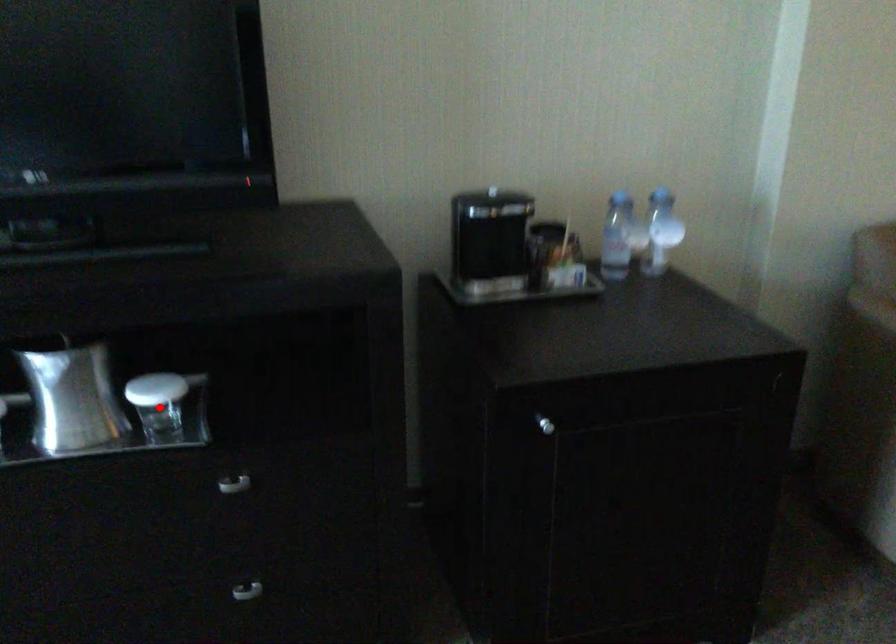
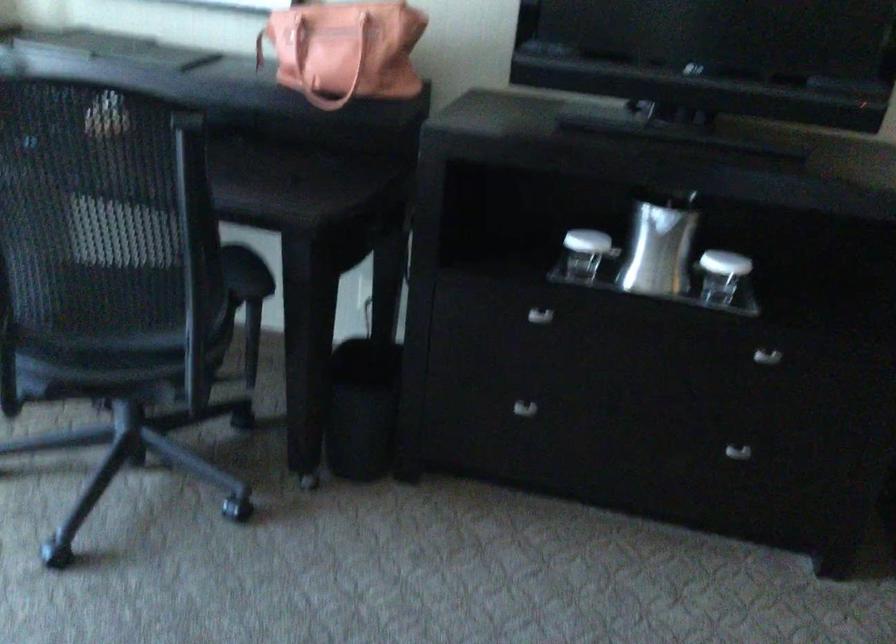
Question: I am providing you with two images of the same scene from different viewpoints. Image1 has a red point marked. In image2, the corresponding 3D location appears at what relative position? Reply with the corresponding letter.

Choices:
 (A) Closer
 (B) Farther

Answer: (B)